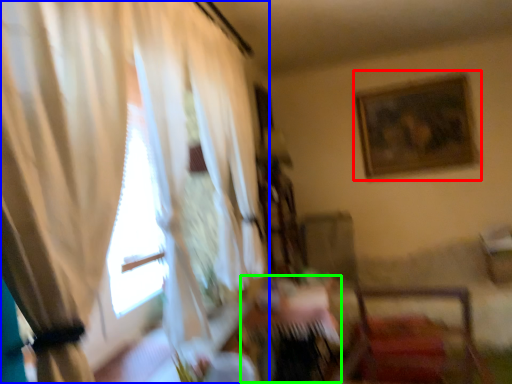
Question: Based on their relative distances, which object is farther from picture frame (highlighted by a red box)? Choose from curtain (highlighted by a blue box) and table (highlighted by a green box).

Choices:
 (A) curtain
 (B) table

Answer: (A)